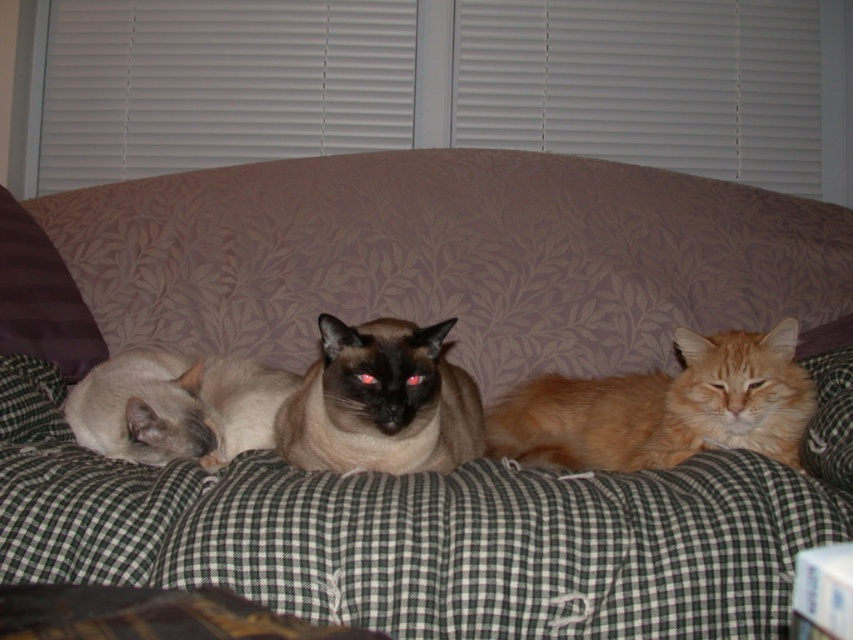
You are a cat owner trying to place a new toy between the orange fluffy cat at center and the silky white cat at left. Can you fit a toy that is 18 inches long between them?

The distance between the orange fluffy cat at center and the silky white cat at left is 18.41 inches. Since the toy is 18 inches long, there is enough space to fit it between them.

You are a cat owner trying to take a photo of the two points on the couch where the middle cat is sitting. The first point is at coordinates point (722, 348) and the second point is at point (207, 440). Which point should you focus on to capture the middle cat in the foreground of your photo?

You should focus on point (722, 348) because it is closer to the viewer than point (207, 440), making it ideal for capturing the middle cat in the foreground.

You are a cat owner who wants to place a new toy between the smokey brown fur at center and the brown striped pillow at left. Which object should you place the toy closer to if you want it to be near the larger object?

The smokey brown fur at center is bigger than the brown striped pillow at left, so you should place the toy closer to the smokey brown fur at center.